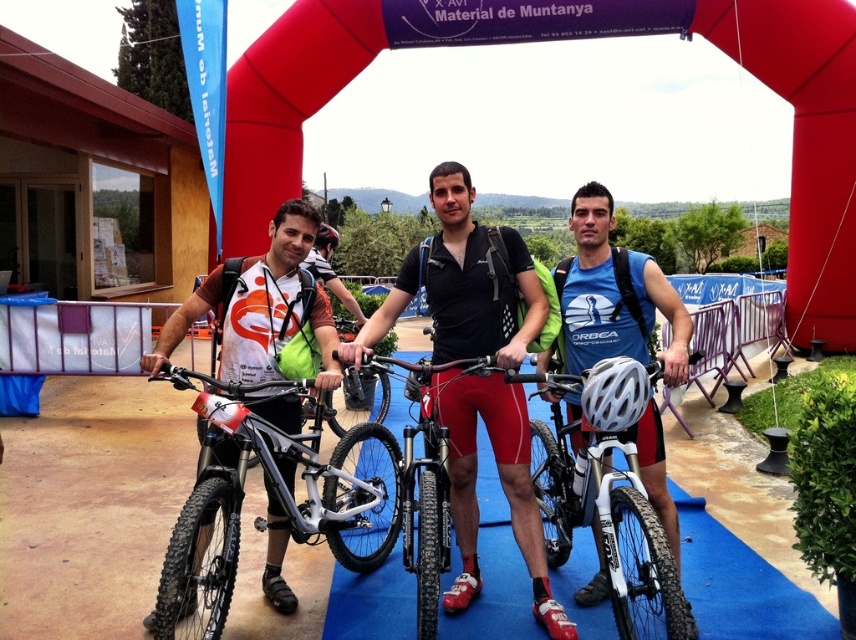
Based on the scene description, where exactly is the matte black bicycle at center located in the image?

The matte black bicycle at center is located at point coordinates of (x=456, y=284).

You are a photographer at the event and need to position yourself so that both the silver metallic bicycle at center and the blue matte jersey at center are visible in your shot. Considering their heights, which object should be placed closer to the front of the frame to ensure both are fully visible?

The silver metallic bicycle at center is shorter than the blue matte jersey at center, so placing the silver metallic bicycle at center closer to the front of the frame will allow both to be fully visible without one blocking the other.